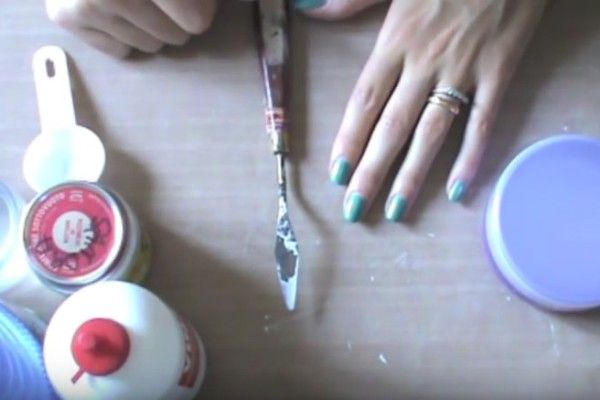
You are a GUI agent. You are given a task and a screenshot of the screen. Output one action in this format:
    pyautogui.click(x=<x>, y=<y>)
    Task: Click on the counter top
    Image resolution: width=600 pixels, height=400 pixels.
    Given the screenshot: What is the action you would take?
    pyautogui.click(x=213, y=176)